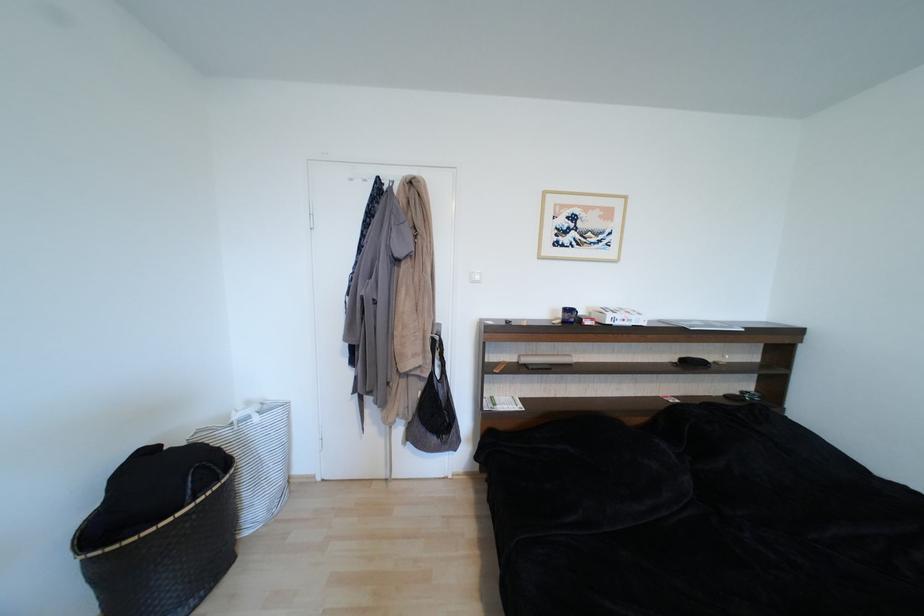
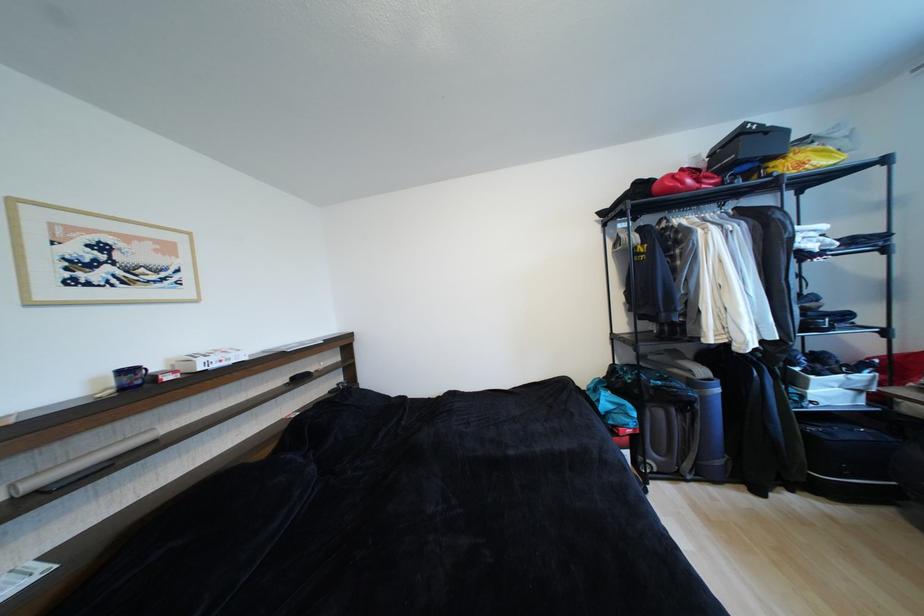
Question: I am providing you with two images of the same scene from different viewpoints. After the viewpoint changes to image2, which objects are now occluded?

Choices:
 (A) red bag
 (B) blue mug
 (C) cardboard tube roll
 (D) none of these

Answer: (D)